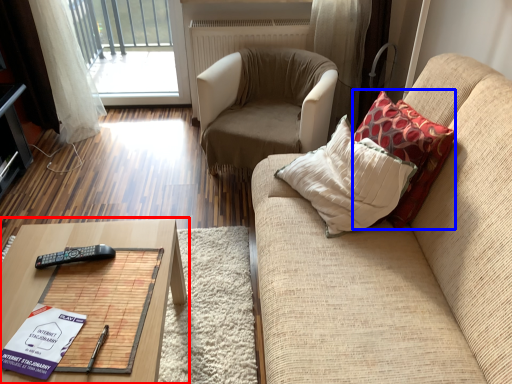
Question: Among these objects, which one is nearest to the camera, table (highlighted by a red box) or throw pillow (highlighted by a blue box)?

Choices:
 (A) table
 (B) throw pillow

Answer: (A)